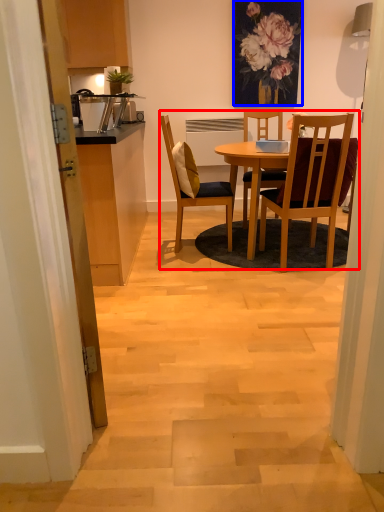
Question: Which of the following is the closest to the observer, kitchen & dining room table (highlighted by a red box) or floral arrangement (highlighted by a blue box)?

Choices:
 (A) kitchen & dining room table
 (B) floral arrangement

Answer: (A)